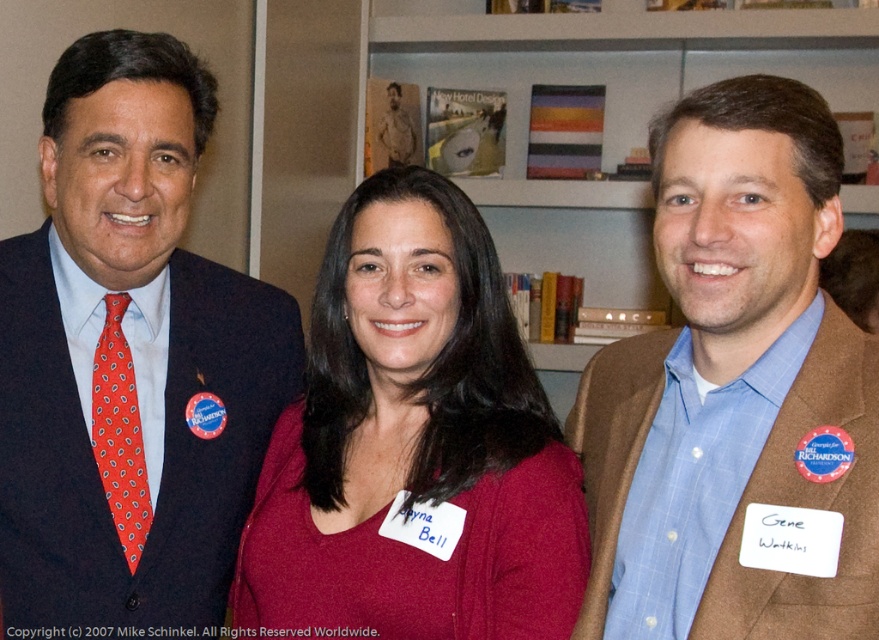
Describe the element at coordinates (736, 394) in the screenshot. I see `brown textured blazer at center` at that location.

Does point (649, 460) come closer to viewer compared to point (100, 403)?

Yes, point (649, 460) is closer to viewer.

This screenshot has width=879, height=640. In order to click on brown textured blazer at center in this screenshot , I will do `click(736, 394)`.

Between matte red shirt at center and hardcover books at upper center, which one has more height?

hardcover books at upper center is taller.

Is matte red shirt at center below hardcover books at upper center?

Yes, matte red shirt at center is below hardcover books at upper center.

The height and width of the screenshot is (640, 879). Find the location of `matte red shirt at center`. matte red shirt at center is located at coordinates (413, 444).

Which is more to the right, matte black suit at left or matte red shirt at center?

matte red shirt at center is more to the right.

Locate an element on the screen. The height and width of the screenshot is (640, 879). matte black suit at left is located at coordinates 128,362.

In order to click on matte black suit at left in this screenshot , I will do `click(128, 362)`.